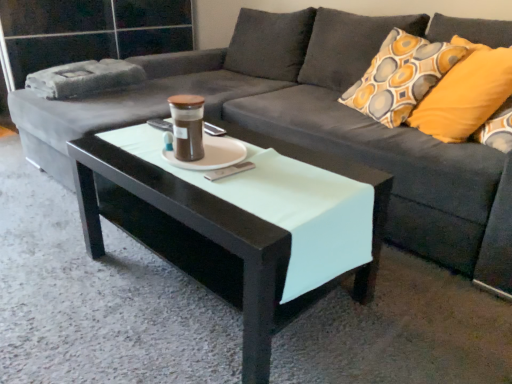
Locate an element on the screen. free point in front of brown glass jar at center is located at coordinates (192, 185).